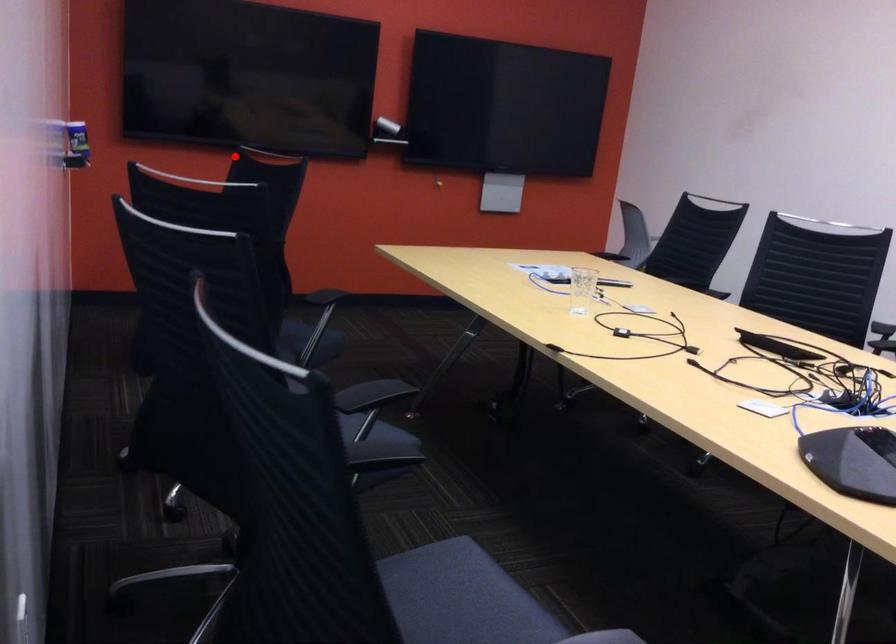
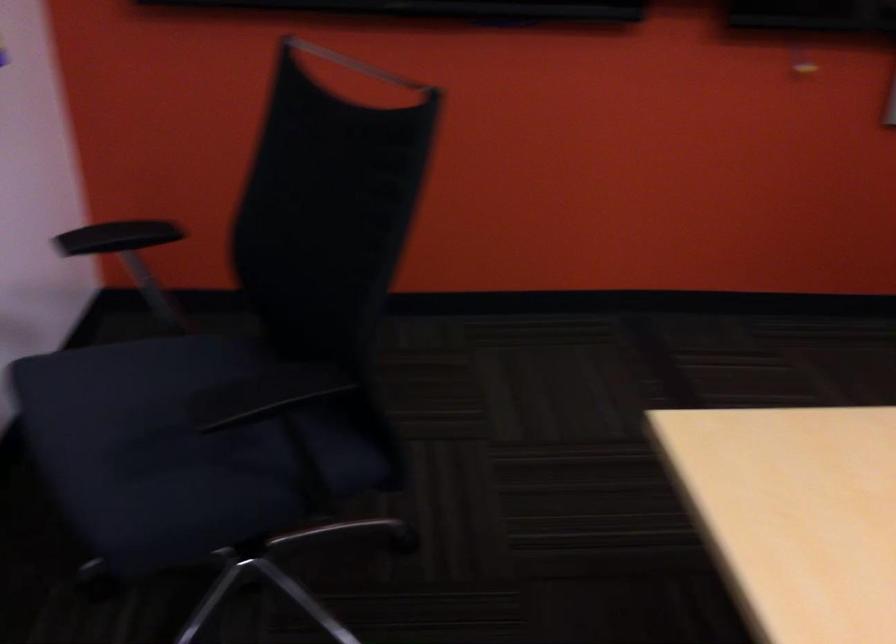
Question: I am providing you with two images of the same scene from different viewpoints. A red point is shown in image1. For the corresponding object point in image2, is it positioned nearer or farther from the camera?

Choices:
 (A) Nearer
 (B) Farther

Answer: (A)